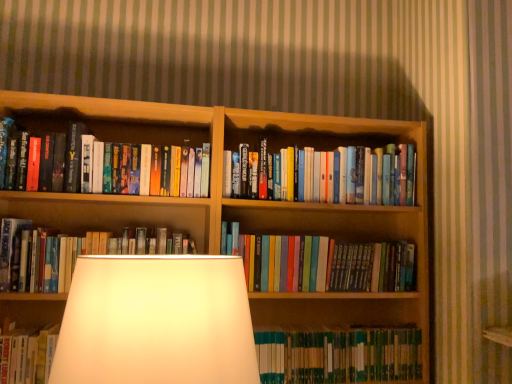
Question: Is hardcover books at center, which ranks as the third book in top-to-bottom order, outside of wooden bookcase at center?

Choices:
 (A) no
 (B) yes

Answer: (A)

Question: Does hardcover books at center, which ranks as the third book in top-to-bottom order, appear on the right side of wooden bookcase at center?

Choices:
 (A) no
 (B) yes

Answer: (A)

Question: Considering the relative sizes of hardcover books at center, positioned as the third book in bottom-to-top order, and wooden bookcase at center in the image provided, is hardcover books at center, positioned as the third book in bottom-to-top order, thinner than wooden bookcase at center?

Choices:
 (A) no
 (B) yes

Answer: (B)

Question: Does hardcover books at center, which ranks as the third book in top-to-bottom order, lie in front of wooden bookcase at center?

Choices:
 (A) no
 (B) yes

Answer: (A)

Question: From a real-world perspective, is hardcover books at center, which ranks as the third book in top-to-bottom order, under wooden bookcase at center?

Choices:
 (A) yes
 (B) no

Answer: (B)

Question: Considering the relative sizes of hardcover books at center, positioned as the third book in bottom-to-top order, and wooden bookcase at center in the image provided, is hardcover books at center, positioned as the third book in bottom-to-top order, smaller than wooden bookcase at center?

Choices:
 (A) no
 (B) yes

Answer: (B)

Question: From the image's perspective, is green hardcover book at center, acting as the fifth book starting from the top, under hardcover books at center, positioned as the third book in bottom-to-top order?

Choices:
 (A) yes
 (B) no

Answer: (A)

Question: Does green hardcover book at center, the 1th book ordered from the bottom, appear on the left side of hardcover books at center, which ranks as the third book in top-to-bottom order?

Choices:
 (A) no
 (B) yes

Answer: (A)

Question: From a real-world perspective, is green hardcover book at center, acting as the fifth book starting from the top, under hardcover books at center, which ranks as the third book in top-to-bottom order?

Choices:
 (A) yes
 (B) no

Answer: (A)

Question: Can you confirm if green hardcover book at center, acting as the fifth book starting from the top, is wider than hardcover books at center, positioned as the third book in bottom-to-top order?

Choices:
 (A) yes
 (B) no

Answer: (A)

Question: Is green hardcover book at center, the 1th book ordered from the bottom, further to the viewer compared to hardcover books at center, which ranks as the third book in top-to-bottom order?

Choices:
 (A) yes
 (B) no

Answer: (A)

Question: Are green hardcover book at center, acting as the fifth book starting from the top, and hardcover books at center, which ranks as the third book in top-to-bottom order, making contact?

Choices:
 (A) no
 (B) yes

Answer: (A)

Question: Does wooden bookcase at center turn towards hardcover books at center, the 2th book positioned from the bottom?

Choices:
 (A) yes
 (B) no

Answer: (A)